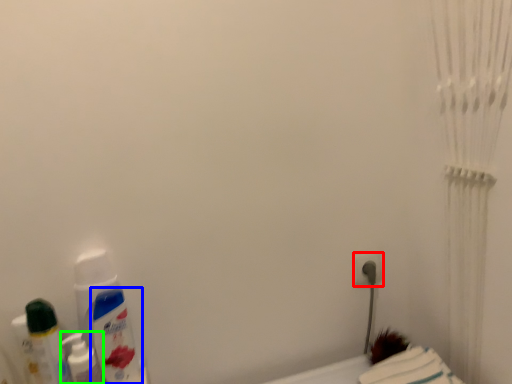
Question: Considering the real-world distances, which object is closest to power plugs and sockets (highlighted by a red box)? mouthwash (highlighted by a blue box) or mouthwash (highlighted by a green box).

Choices:
 (A) mouthwash
 (B) mouthwash

Answer: (A)